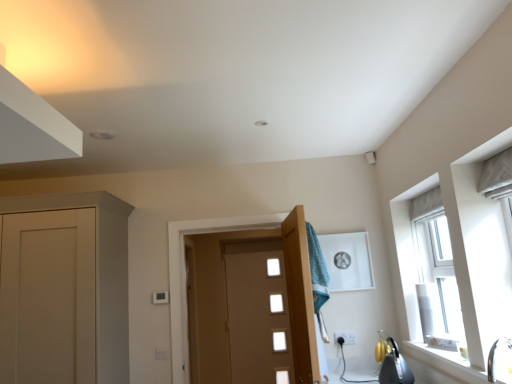
Question: From a real-world perspective, is white ceramic window sill at lower right below white glossy sink at lower right?

Choices:
 (A) no
 (B) yes

Answer: (B)

Question: Is white ceramic window sill at lower right smaller than white glossy sink at lower right?

Choices:
 (A) no
 (B) yes

Answer: (A)

Question: Could you tell me if white ceramic window sill at lower right is facing white glossy sink at lower right?

Choices:
 (A) yes
 (B) no

Answer: (B)

Question: Considering the relative positions of white ceramic window sill at lower right and white glossy sink at lower right in the image provided, is white ceramic window sill at lower right in front of white glossy sink at lower right?

Choices:
 (A) no
 (B) yes

Answer: (A)

Question: Considering the relative sizes of white ceramic window sill at lower right and white glossy sink at lower right in the image provided, is white ceramic window sill at lower right shorter than white glossy sink at lower right?

Choices:
 (A) yes
 (B) no

Answer: (A)

Question: From the image's perspective, is white ceramic window sill at lower right under white glossy sink at lower right?

Choices:
 (A) yes
 (B) no

Answer: (A)

Question: Considering the relative sizes of white plastic electric outlet at lower center and wooden door at center, the second door from the back, in the image provided, is white plastic electric outlet at lower center smaller than wooden door at center, the second door from the back,?

Choices:
 (A) no
 (B) yes

Answer: (B)

Question: Considering the relative positions of white plastic electric outlet at lower center and wooden door at center, positioned as the first door in front-to-back order, in the image provided, is white plastic electric outlet at lower center to the left of wooden door at center, positioned as the first door in front-to-back order, from the viewer's perspective?

Choices:
 (A) no
 (B) yes

Answer: (A)

Question: Is white plastic electric outlet at lower center next to wooden door at center, the second door from the back?

Choices:
 (A) no
 (B) yes

Answer: (A)

Question: Considering the relative sizes of white plastic electric outlet at lower center and wooden door at center, the second door from the back, in the image provided, is white plastic electric outlet at lower center thinner than wooden door at center, the second door from the back,?

Choices:
 (A) yes
 (B) no

Answer: (A)

Question: From a real-world perspective, is white plastic electric outlet at lower center below wooden door at center, positioned as the first door in front-to-back order?

Choices:
 (A) yes
 (B) no

Answer: (A)

Question: From a real-world perspective, is white plastic electric outlet at lower center on wooden door at center, the second door from the back?

Choices:
 (A) yes
 (B) no

Answer: (B)

Question: Considering the relative positions of teal fabric towel at center and matte brown door at center, the second door when ordered from front to back, in the image provided, is teal fabric towel at center in front of matte brown door at center, the second door when ordered from front to back,?

Choices:
 (A) yes
 (B) no

Answer: (A)